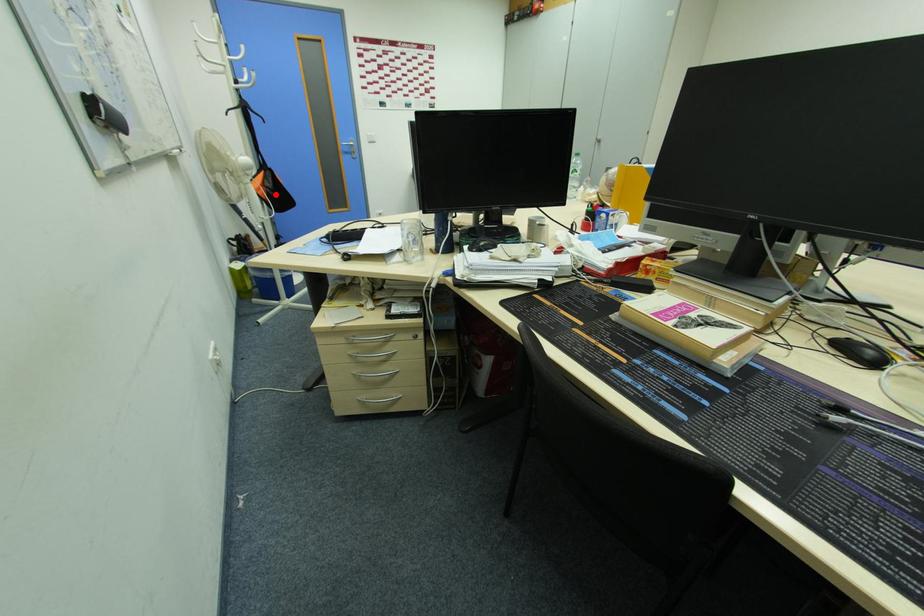
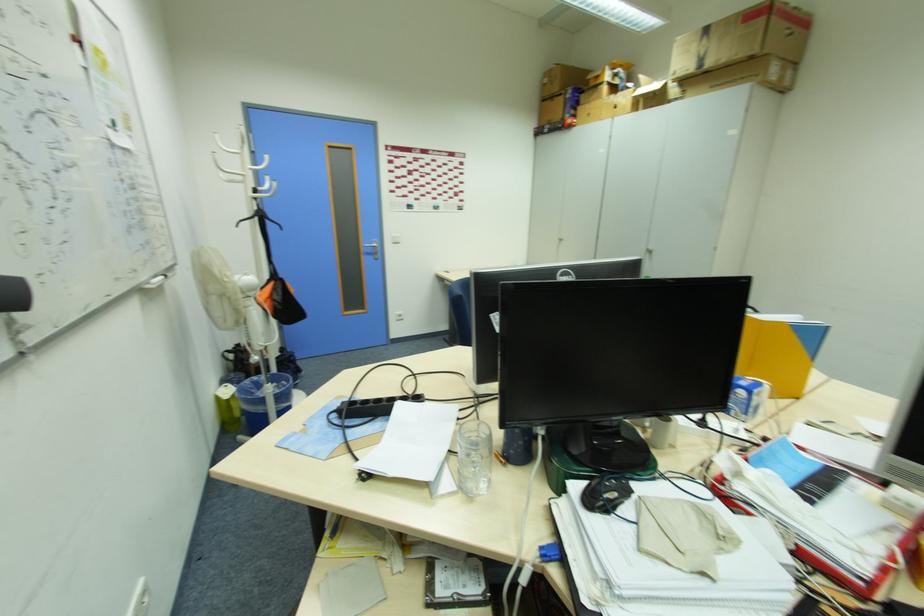
The point at the highlighted location is marked in the first image. Where is the corresponding point in the second image?

(283, 309)